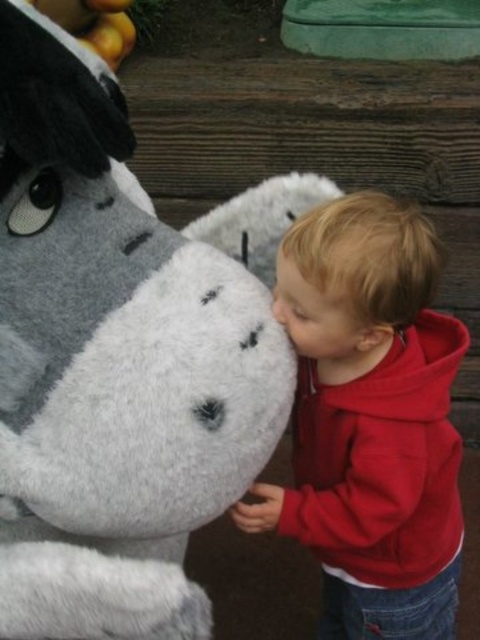
Question: Does fluffy gray plush at left appear under fuzzy gray nose at lower center?

Choices:
 (A) no
 (B) yes

Answer: (A)

Question: Among these points, which one is farthest from the camera?

Choices:
 (A) (29, 628)
 (B) (278, 298)

Answer: (B)

Question: Which object is positioned farthest from the fuzzy gray nose at lower center?

Choices:
 (A) fluffy gray plush at left
 (B) red fleece hoodie at lower right

Answer: (B)

Question: Does red fleece hoodie at lower right appear on the right side of fuzzy gray nose at lower center?

Choices:
 (A) no
 (B) yes

Answer: (B)

Question: Is red fleece hoodie at lower right to the left of fuzzy gray nose at lower center from the viewer's perspective?

Choices:
 (A) no
 (B) yes

Answer: (A)

Question: Which point is farther to the camera?

Choices:
 (A) red fleece hoodie at lower right
 (B) fluffy gray plush at left
 (C) fuzzy gray nose at lower center

Answer: (C)